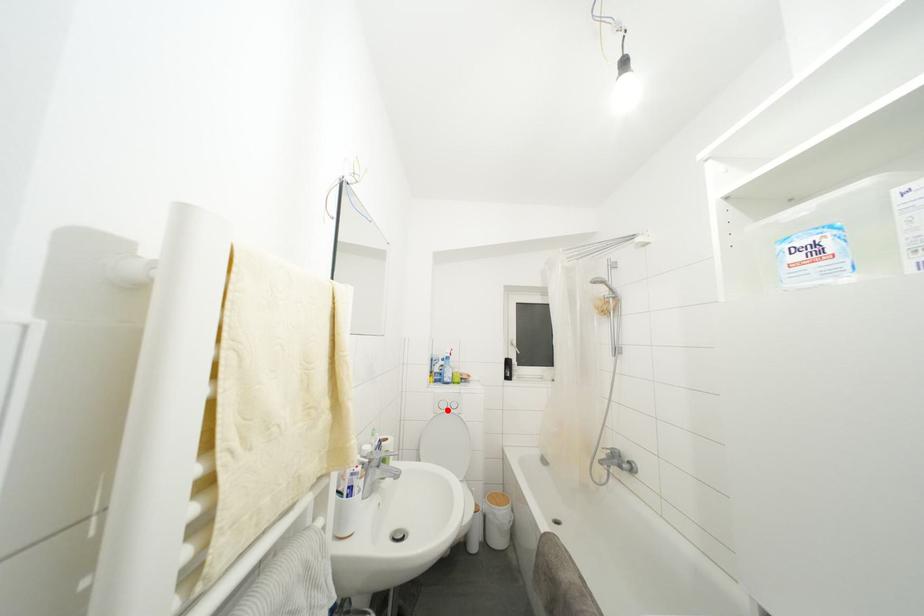
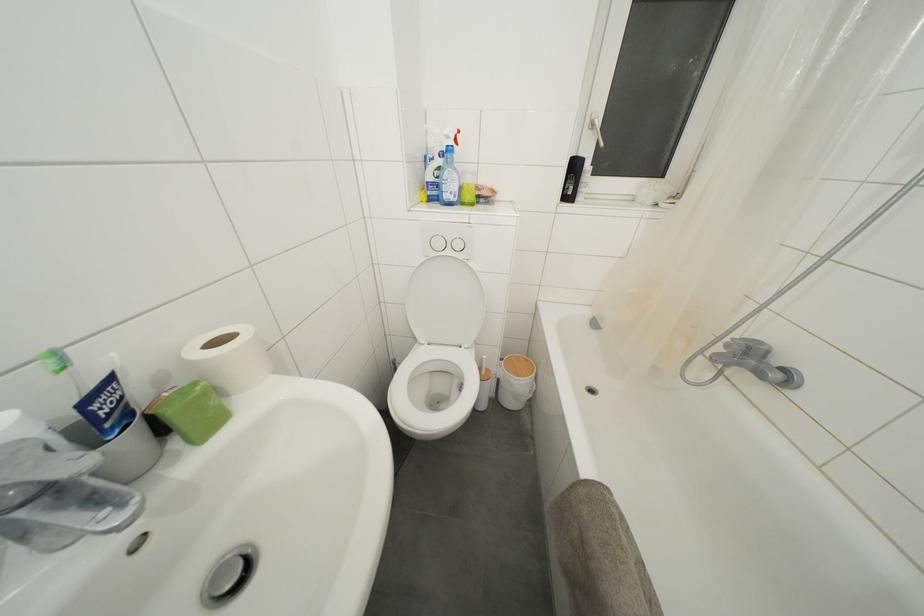
Question: I am providing you with two images of the same scene from different viewpoints. A red point is shown in image1. For the corresponding object point in image2, is it positioned nearer or farther from the camera?

Choices:
 (A) Nearer
 (B) Farther

Answer: (A)